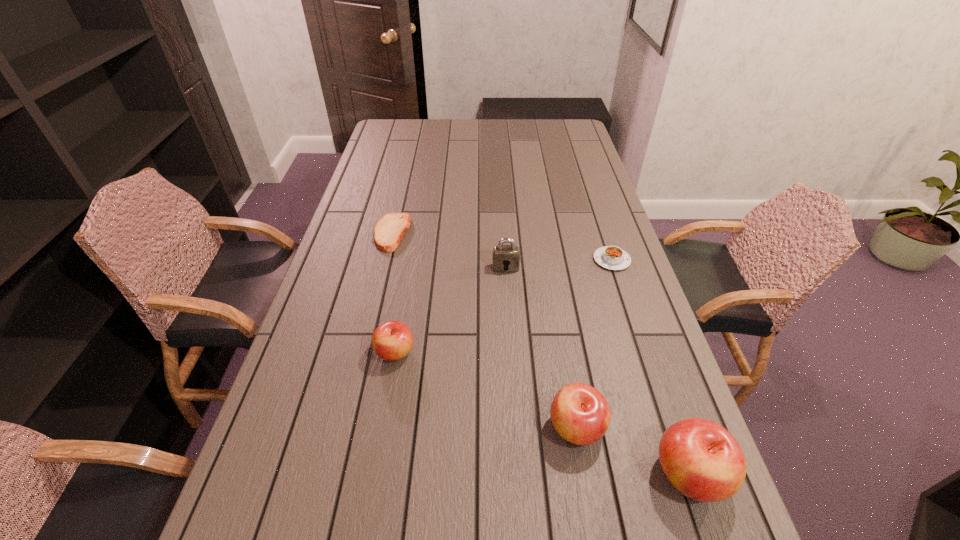
This screenshot has height=540, width=960. I want to click on empty location between the fourth object from right to left and the tallest object, so click(x=597, y=371).

Where is `vacant area that lies between the pita bread and the tallest apple`? Image resolution: width=960 pixels, height=540 pixels. vacant area that lies between the pita bread and the tallest apple is located at coordinates (540, 354).

Image resolution: width=960 pixels, height=540 pixels. I want to click on free spot between the second shortest object and the tallest apple, so click(x=651, y=367).

Image resolution: width=960 pixels, height=540 pixels. I want to click on vacant space that's between the tallest apple and the fifth tallest object, so click(x=651, y=367).

The width and height of the screenshot is (960, 540). What are the coordinates of `free space between the pudding and the padlock` in the screenshot? It's located at (559, 264).

Image resolution: width=960 pixels, height=540 pixels. I want to click on vacant area that lies between the fourth object from right to left and the fifth tallest object, so (x=559, y=264).

Select which object is the closest to the rightmost apple. Please provide its 2D coordinates. Your answer should be formatted as a tuple, i.e. [(x, y)], where the tuple contains the x and y coordinates of a point satisfying the conditions above.

[(580, 414)]

Identify which object is located as the third nearest to the padlock. Please provide its 2D coordinates. Your answer should be formatted as a tuple, i.e. [(x, y)], where the tuple contains the x and y coordinates of a point satisfying the conditions above.

[(393, 340)]

Choose which apple is the nearest neighbor to the pudding. Please provide its 2D coordinates. Your answer should be formatted as a tuple, i.e. [(x, y)], where the tuple contains the x and y coordinates of a point satisfying the conditions above.

[(580, 414)]

Select which apple is the second closest to the pudding. Please provide its 2D coordinates. Your answer should be formatted as a tuple, i.e. [(x, y)], where the tuple contains the x and y coordinates of a point satisfying the conditions above.

[(701, 459)]